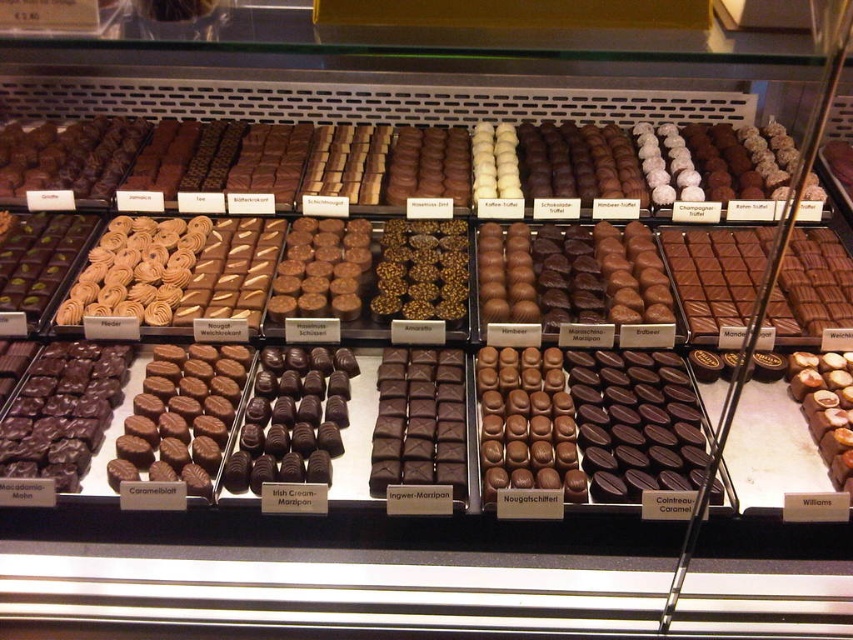
Who is more distant from viewer, (370, 467) or (386, 298)?

Positioned behind is point (386, 298).

Is point (375, 460) positioned behind point (463, 230)?

No, (375, 460) is in front of (463, 230).

What are the coordinates of `dark chocolate at center` in the screenshot? It's located at (419, 420).

Is dark chocolate candy at center-right thinner than matte chocolate nougat at center?

Incorrect, dark chocolate candy at center-right's width is not less than matte chocolate nougat at center's.

Which is behind, point (682, 392) or point (564, 376)?

Point (564, 376)

Who is more distant from viewer, (x=634, y=448) or (x=502, y=348)?

Point (x=502, y=348)

This screenshot has height=640, width=853. I want to click on dark chocolate candy at center-right, so point(635,422).

Is matte chocolate nougat at center smaller than shiny dark chocolate square at left?

Yes, matte chocolate nougat at center is smaller than shiny dark chocolate square at left.

Is point (561, 371) positioned before point (57, 426)?

No, it is behind (57, 426).

The image size is (853, 640). In order to click on matte chocolate nougat at center in this screenshot , I will do point(526,422).

This screenshot has width=853, height=640. Find the location of `matte chocolate nougat at center`. matte chocolate nougat at center is located at coordinates (526, 422).